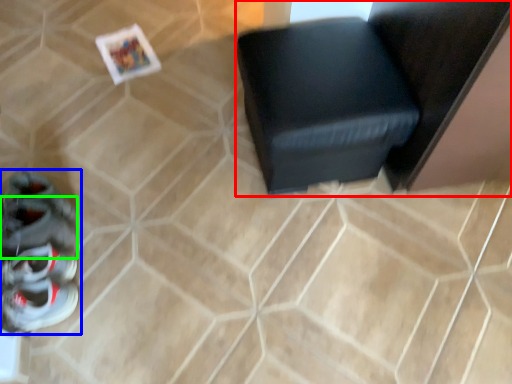
Question: Based on their relative distances, which object is nearer to furniture (highlighted by a red box)? Choose from footwear (highlighted by a blue box) and shoe (highlighted by a green box).

Choices:
 (A) footwear
 (B) shoe

Answer: (A)